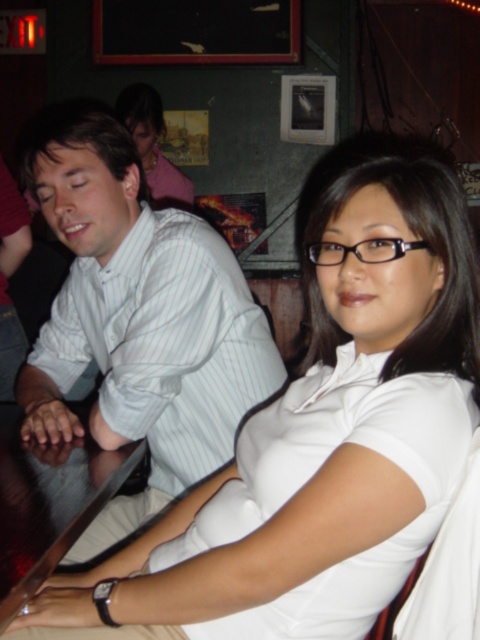
Question: Which object is closer to the camera taking this photo?

Choices:
 (A) pink fabric at upper left
 (B) white striped shirt at left
 (C) dark wood table at lower left

Answer: (C)

Question: Can you confirm if white striped shirt at left is bigger than pink fabric at upper left?

Choices:
 (A) no
 (B) yes

Answer: (B)

Question: Which point appears closest to the camera in this image?

Choices:
 (A) (70, 419)
 (B) (80, 445)

Answer: (B)

Question: Observing the image, what is the correct spatial positioning of white striped shirt at left in reference to dark wood table at lower left?

Choices:
 (A) right
 (B) left

Answer: (A)

Question: Can you confirm if white striped shirt at left is thinner than dark wood table at lower left?

Choices:
 (A) no
 (B) yes

Answer: (A)

Question: Considering the real-world distances, which object is farthest from the pink fabric at upper left?

Choices:
 (A) white striped shirt at left
 (B) dark wood table at lower left

Answer: (B)